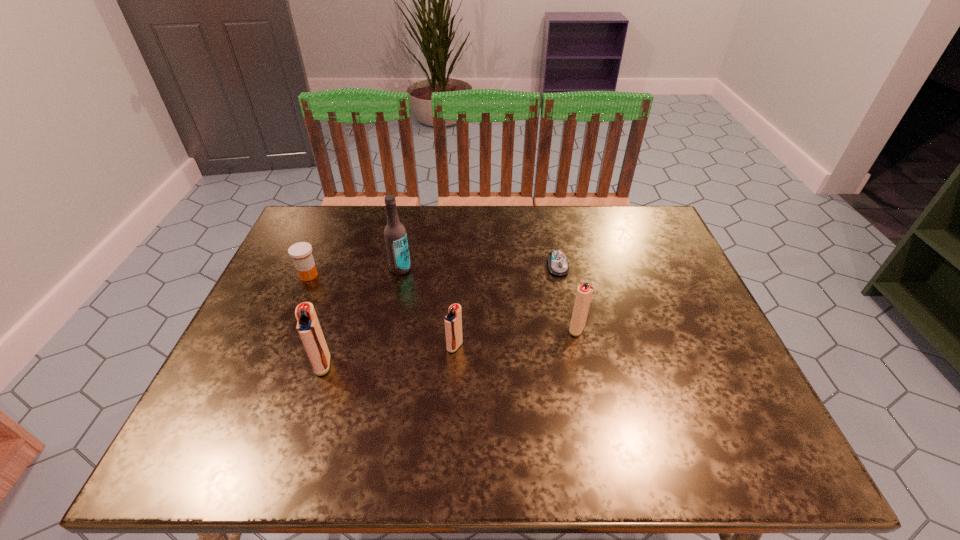
Find the location of a particular element. This screenshot has height=540, width=960. free spot between the leftmost igniter and the fourth object from left to right is located at coordinates (389, 355).

Image resolution: width=960 pixels, height=540 pixels. I want to click on free area in between the second shortest igniter and the shortest object, so click(567, 298).

Identify which object is located as the nearest to the leftmost object. Please provide its 2D coordinates. Your answer should be formatted as a tuple, i.e. [(x, y)], where the tuple contains the x and y coordinates of a point satisfying the conditions above.

[(395, 235)]

Identify the location of the closest object to the third object from left to right. (301, 252).

Identify which igniter is located as the second nearest to the second tallest igniter. Please provide its 2D coordinates. Your answer should be formatted as a tuple, i.e. [(x, y)], where the tuple contains the x and y coordinates of a point satisfying the conditions above.

[(308, 327)]

Locate an element on the screen. This screenshot has height=540, width=960. igniter that is the third closest to the fourth object from right to left is located at coordinates (584, 293).

The image size is (960, 540). I want to click on vacant point that satisfies the following two spatial constraints: 1. on the label of the leftmost igniter; 2. on the right side of the medicine, so click(270, 364).

The image size is (960, 540). I want to click on free point that satisfies the following two spatial constraints: 1. on the label of the second shortest igniter; 2. on the left side of the third object from left to right, so click(x=388, y=329).

Image resolution: width=960 pixels, height=540 pixels. In order to click on vacant area that satisfies the following two spatial constraints: 1. on the back side of the farthest igniter; 2. on the right side of the fifth object from right to left in this screenshot , I will do `click(334, 329)`.

Locate an element on the screen. This screenshot has width=960, height=540. vacant area that satisfies the following two spatial constraints: 1. on the wheel side of the shortest object; 2. on the left side of the second tallest igniter is located at coordinates (570, 329).